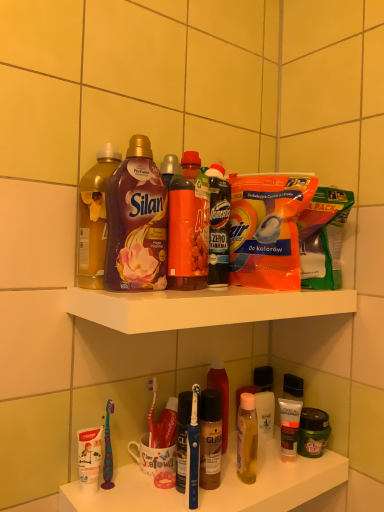
This screenshot has width=384, height=512. Describe the element at coordinates (290, 415) in the screenshot. I see `matte black tube at lower right, which is the second toiletry from front to back` at that location.

Where is `matte black tube at lower right, which is the second toiletry from front to back`? The height and width of the screenshot is (512, 384). matte black tube at lower right, which is the second toiletry from front to back is located at coordinates (290, 415).

What do you see at coordinates (201, 307) in the screenshot? This screenshot has height=512, width=384. I see `white plastic shelf at upper center` at bounding box center [201, 307].

Measure the distance between purple glossy liquid at upper center, the first bottle viewed from the front, and camera.

purple glossy liquid at upper center, the first bottle viewed from the front, is 75.11 centimeters from camera.

What do you see at coordinates (136, 222) in the screenshot?
I see `purple glossy liquid at upper center, the third bottle in the bottom-to-top sequence` at bounding box center [136, 222].

This screenshot has width=384, height=512. I want to click on orange plastic packet at upper center, so click(267, 228).

This screenshot has height=512, width=384. I want to click on blue plastic toothbrush at lower center, so click(193, 454).

At what (x,y) coordinates should I click in order to perform the action: click on toothbrush on the left of matte black tube at lower right, which is the second toiletry from front to back. Please return your answer as a coordinate pair (x, y). Looking at the image, I should click on (193, 454).

Considering the points (189, 429) and (298, 402), which point is behind, point (189, 429) or point (298, 402)?

The point (298, 402) is behind.

Can you tell me how much blue plastic toothbrush at lower center and matte black tube at lower right, the 2th toiletry in the back-to-front sequence, differ in facing direction?

The angular difference between blue plastic toothbrush at lower center and matte black tube at lower right, the 2th toiletry in the back-to-front sequence, is 0.00027 degrees.

Between blue plastic toothbrush at lower center and matte black tube at lower right, which is the second toiletry from front to back, which one has smaller width?

matte black tube at lower right, which is the second toiletry from front to back, is thinner.

Which is closer to the camera, (198,494) or (265,368)?

Positioned in front is point (198,494).

From a real-world perspective, is blue plastic toothbrush at lower center located beneath white glossy bottle at lower center, marked as the 3th toiletry in a front-to-back arrangement?

No, from a real-world perspective, blue plastic toothbrush at lower center is not under white glossy bottle at lower center, marked as the 3th toiletry in a front-to-back arrangement.

Looking at their sizes, would you say blue plastic toothbrush at lower center is wider or thinner than white glossy bottle at lower center, the first toiletry positioned from the back?

Considering their sizes, blue plastic toothbrush at lower center looks broader than white glossy bottle at lower center, the first toiletry positioned from the back.

From a real-world perspective, which object stands above the other?

From a 3D spatial view, orange plastic packet at upper center is above.

What's the angular difference between orange plastic packet at upper center and matte black hair mask at lower right, the third toiletry in the back-to-front sequence,'s facing directions?

There is a 1.37-degree angle between the facing directions of orange plastic packet at upper center and matte black hair mask at lower right, the third toiletry in the back-to-front sequence.

Can you see orange plastic packet at upper center touching matte black hair mask at lower right, the third toiletry in the back-to-front sequence?

No, orange plastic packet at upper center is not with matte black hair mask at lower right, the third toiletry in the back-to-front sequence.

Is orange plastic packet at upper center aimed at matte black hair mask at lower right, the third toiletry in the back-to-front sequence?

No, orange plastic packet at upper center does not turn towards matte black hair mask at lower right, the third toiletry in the back-to-front sequence.

Would you say translucent plastic bottle at center, which appears as the first bottle when ordered from the bottom, is outside white glossy bottle at lower center, the first toiletry positioned from the back?

Yes, translucent plastic bottle at center, which appears as the first bottle when ordered from the bottom, is located beyond the bounds of white glossy bottle at lower center, the first toiletry positioned from the back.

Considering the sizes of translucent plastic bottle at center, which ranks as the first bottle in right-to-left order, and white glossy bottle at lower center, the first toiletry positioned from the back, in the image, is translucent plastic bottle at center, which ranks as the first bottle in right-to-left order, taller or shorter than white glossy bottle at lower center, the first toiletry positioned from the back,?

Clearly, translucent plastic bottle at center, which ranks as the first bottle in right-to-left order, is taller compared to white glossy bottle at lower center, the first toiletry positioned from the back.

Is translucent plastic bottle at center, which is counted as the 3th bottle, starting from the front, far away from white glossy bottle at lower center, the first toiletry positioned from the back?

No, there isn't a large distance between translucent plastic bottle at center, which is counted as the 3th bottle, starting from the front, and white glossy bottle at lower center, the first toiletry positioned from the back.

From a real-world perspective, which object rests below the other?

white glossy bottle at lower center, marked as the 3th toiletry in a front-to-back arrangement.

Is there a large distance between white plastic shelf at upper center and matte black hair mask at lower right, the third toiletry in the back-to-front sequence?

No, white plastic shelf at upper center is in close proximity to matte black hair mask at lower right, the third toiletry in the back-to-front sequence.

Who is smaller, white plastic shelf at upper center or matte black hair mask at lower right, which is the first toiletry from front to back?

Smaller between the two is matte black hair mask at lower right, which is the first toiletry from front to back.

Which is more to the right, white plastic shelf at upper center or matte black hair mask at lower right, the third toiletry in the back-to-front sequence?

From the viewer's perspective, matte black hair mask at lower right, the third toiletry in the back-to-front sequence, appears more on the right side.

From the image's perspective, which is above, matte purple fabric softener at upper center, marked as the 2th bottle in a bottom-to-top arrangement, or blue plastic toothbrush at lower center?

matte purple fabric softener at upper center, marked as the 2th bottle in a bottom-to-top arrangement.

Which of these two, matte purple fabric softener at upper center, acting as the second bottle starting from the top, or blue plastic toothbrush at lower center, stands shorter?

Standing shorter between the two is blue plastic toothbrush at lower center.

Considering the relative positions of matte purple fabric softener at upper center, which is the 1th bottle in left-to-right order, and blue plastic toothbrush at lower center in the image provided, is matte purple fabric softener at upper center, which is the 1th bottle in left-to-right order, to the left of blue plastic toothbrush at lower center from the viewer's perspective?

Correct, you'll find matte purple fabric softener at upper center, which is the 1th bottle in left-to-right order, to the left of blue plastic toothbrush at lower center.

Is matte purple fabric softener at upper center, marked as the 2th bottle in a bottom-to-top arrangement, positioned beyond the bounds of blue plastic toothbrush at lower center?

Yes, matte purple fabric softener at upper center, marked as the 2th bottle in a bottom-to-top arrangement, is not within blue plastic toothbrush at lower center.

Is white plastic toothbrushes at lower left not inside matte black hair mask at lower right, which is the first toiletry from front to back?

Indeed, white plastic toothbrushes at lower left is completely outside matte black hair mask at lower right, which is the first toiletry from front to back.

From a real-world perspective, between white plastic toothbrushes at lower left and matte black hair mask at lower right, the third toiletry in the back-to-front sequence, who is vertically lower?

From a 3D spatial view, white plastic toothbrushes at lower left is below.

From the image's perspective, which one is positioned higher, white plastic toothbrushes at lower left or matte black hair mask at lower right, which is the first toiletry from front to back?

matte black hair mask at lower right, which is the first toiletry from front to back, appears higher in the image.

From the picture: Does white plastic toothbrushes at lower left turn towards matte black hair mask at lower right, the third toiletry in the back-to-front sequence?

No.

The width and height of the screenshot is (384, 512). Find the location of `toothbrush located above the matte black tube at lower right, which is the second toiletry from front to back (from a real-world perspective)`. toothbrush located above the matte black tube at lower right, which is the second toiletry from front to back (from a real-world perspective) is located at coordinates (193, 454).

From the image's perspective, count 1st toiletrys downward from the blue plastic toothbrush at lower center and point to it. Please provide its 2D coordinates.

[(264, 401)]

Which object lies further to the anchor point orange plastic packet at upper center, white plastic shelf at upper center or matte black hair mask at lower right, which is the first toiletry from front to back?

matte black hair mask at lower right, which is the first toiletry from front to back, lies further to orange plastic packet at upper center than the other object.

Which object lies nearer to the anchor point matte black hair mask at lower right, which is the first toiletry from front to back, matte purple fabric softener at upper center, marked as the 2th bottle in a bottom-to-top arrangement, or purple glossy liquid at upper center, the third bottle in the bottom-to-top sequence?

Among the two, purple glossy liquid at upper center, the third bottle in the bottom-to-top sequence, is located nearer to matte black hair mask at lower right, which is the first toiletry from front to back.

Considering their positions, is orange plastic packet at upper center positioned further to blue plastic toothbrush at lower center than matte black tube at lower right, which is the second toiletry from front to back?

orange plastic packet at upper center is further to blue plastic toothbrush at lower center.

Estimate the real-world distances between objects in this image. Which object is further from white plastic shelf at upper center, orange plastic packet at upper center or purple glossy liquid at upper center, the first bottle viewed from the front?

Among the two, orange plastic packet at upper center is located further to white plastic shelf at upper center.

Which object lies further to the anchor point white plastic shelf at upper center, blue plastic toothbrush at lower center or matte purple fabric softener at upper center, arranged as the second bottle when viewed from the back?

The object further to white plastic shelf at upper center is blue plastic toothbrush at lower center.

Estimate the real-world distances between objects in this image. Which object is further from blue plastic toothbrush at lower center, matte black hair mask at lower right, which is the first toiletry from front to back, or white plastic toothbrushes at lower left?

Among the two, matte black hair mask at lower right, which is the first toiletry from front to back, is located further to blue plastic toothbrush at lower center.

Based on their spatial positions, is matte black hair mask at lower right, the third toiletry in the back-to-front sequence, or translucent plastic bottle at center, the first bottle from the back, closer to blue plastic toothbrush at lower center?

translucent plastic bottle at center, the first bottle from the back, is closer to blue plastic toothbrush at lower center.

Which object lies nearer to the anchor point blue plastic toothbrush at lower center, translucent plastic bottle at center, which is the third bottle in left-to-right order, or white plastic toothbrushes at lower left?

white plastic toothbrushes at lower left is closer to blue plastic toothbrush at lower center.

I want to click on toothbrush between purple glossy liquid at upper center, the first bottle viewed from the front, and matte black tube at lower right, which is the second toiletry from front to back, in the vertical direction, so (x=193, y=454).

Where is `bottle between orange plastic packet at upper center and white glossy bottle at lower center, marked as the 3th toiletry in a front-to-back arrangement, in the vertical direction`? The image size is (384, 512). bottle between orange plastic packet at upper center and white glossy bottle at lower center, marked as the 3th toiletry in a front-to-back arrangement, in the vertical direction is located at coordinates (222, 394).

This screenshot has width=384, height=512. Find the location of `toothbrush between white plastic toothbrushes at lower left and matte black tube at lower right, the 2th toiletry in the back-to-front sequence, along the z-axis`. toothbrush between white plastic toothbrushes at lower left and matte black tube at lower right, the 2th toiletry in the back-to-front sequence, along the z-axis is located at coordinates (193, 454).

Locate an element on the screen. This screenshot has height=512, width=384. toothbrush between white plastic shelf at upper center and matte black tube at lower right, which is the second toiletry from front to back, from front to back is located at coordinates (193, 454).